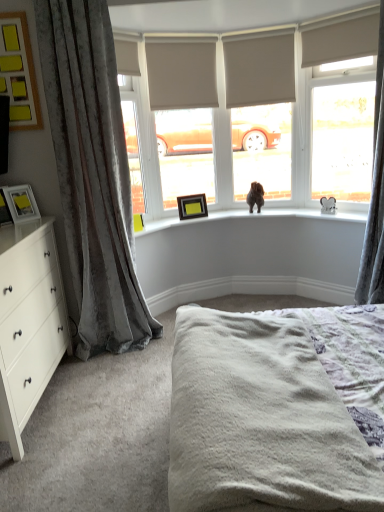
Identify the location of free space above beige fabric blind at upper right, positioned as the first blind in right-to-left order (from a real-world perspective). (325, 10).